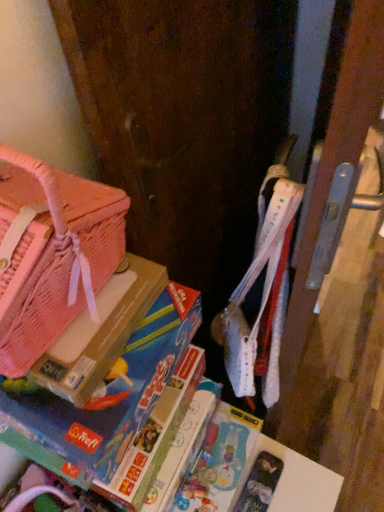
Question: From the image's perspective, is blue cardboard game at left above pink mesh bag at left?

Choices:
 (A) yes
 (B) no

Answer: (B)

Question: Is blue cardboard game at left wider than pink mesh bag at left?

Choices:
 (A) yes
 (B) no

Answer: (A)

Question: Is blue cardboard game at left to the left of pink mesh bag at left from the viewer's perspective?

Choices:
 (A) yes
 (B) no

Answer: (B)

Question: Considering the relative sizes of blue cardboard game at left and pink mesh bag at left in the image provided, is blue cardboard game at left bigger than pink mesh bag at left?

Choices:
 (A) yes
 (B) no

Answer: (A)

Question: Could you tell me if blue cardboard game at left is facing pink mesh bag at left?

Choices:
 (A) yes
 (B) no

Answer: (B)

Question: From their relative heights in the image, would you say blue cardboard game at left is taller or shorter than pink woven handbag at left?

Choices:
 (A) tall
 (B) short

Answer: (B)

Question: From a real-world perspective, relative to pink woven handbag at left, is blue cardboard game at left vertically above or below?

Choices:
 (A) below
 (B) above

Answer: (A)

Question: Is blue cardboard game at left wider or thinner than pink woven handbag at left?

Choices:
 (A) thin
 (B) wide

Answer: (B)

Question: Is blue cardboard game at left in front of or behind pink woven handbag at left in the image?

Choices:
 (A) front
 (B) behind

Answer: (B)

Question: Visually, is pink mesh bag at left positioned to the left or to the right of blue cardboard game at left?

Choices:
 (A) left
 (B) right

Answer: (A)

Question: Relative to blue cardboard game at left, is pink mesh bag at left in front or behind?

Choices:
 (A) behind
 (B) front

Answer: (A)

Question: Is point (114, 344) positioned closer to the camera than point (195, 314)?

Choices:
 (A) closer
 (B) farther

Answer: (A)

Question: Considering the positions of pink mesh bag at left and blue cardboard game at left in the image, is pink mesh bag at left wider or thinner than blue cardboard game at left?

Choices:
 (A) thin
 (B) wide

Answer: (A)

Question: Which is correct: blue cardboard game at left is inside pink mesh bag at left, or outside of it?

Choices:
 (A) inside
 (B) outside

Answer: (B)

Question: Is blue cardboard game at left bigger or smaller than pink mesh bag at left?

Choices:
 (A) big
 (B) small

Answer: (A)